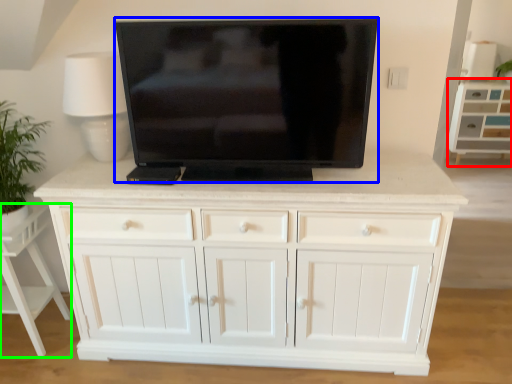
Question: Which object is the closest to the cabinetry (highlighted by a red box)? Choose among these: television (highlighted by a blue box) or vanity (highlighted by a green box).

Choices:
 (A) television
 (B) vanity

Answer: (A)